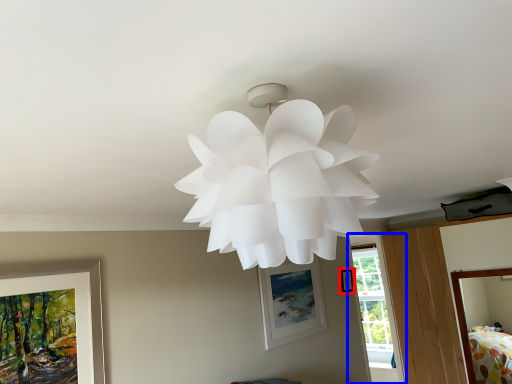
Question: Which point is further to the camera, picture frame (highlighted by a red box) or window (highlighted by a blue box)?

Choices:
 (A) picture frame
 (B) window

Answer: (B)